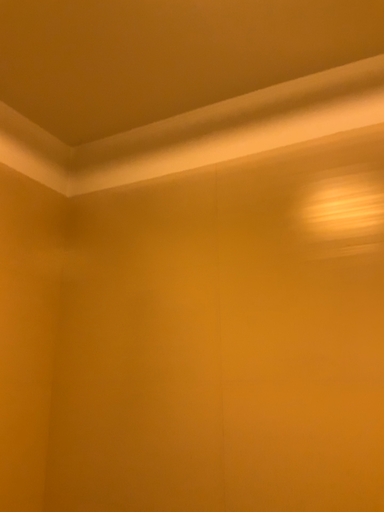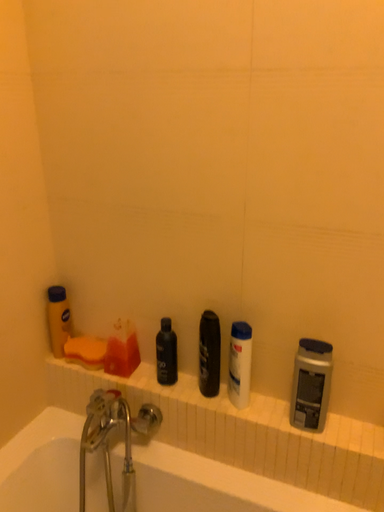
Question: Which way did the camera rotate in the video?

Choices:
 (A) rotated downward
 (B) rotated upward

Answer: (A)